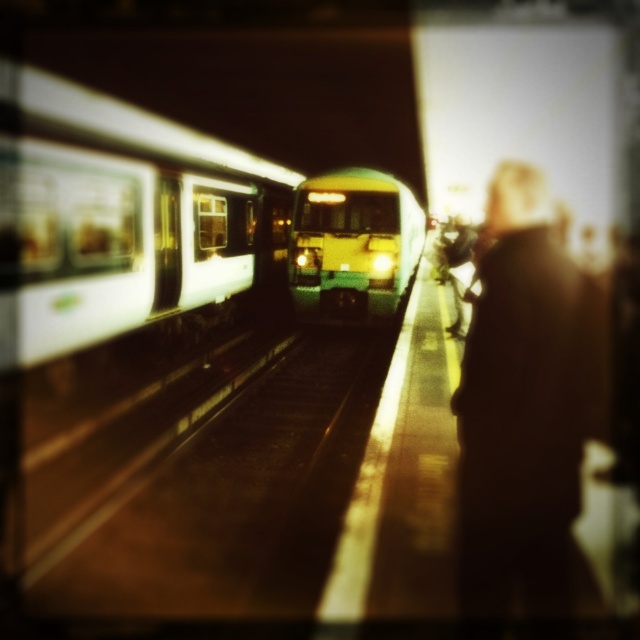
Is white glossy train at left bigger than green matte train at center?

Actually, white glossy train at left might be smaller than green matte train at center.

Between point (44, 227) and point (310, 211), which one is positioned in front?

Positioned in front is point (44, 227).

Where is `white glossy train at left`? The width and height of the screenshot is (640, 640). white glossy train at left is located at coordinates (113, 216).

Between point (532, 538) and point (317, 216), which one is positioned behind?

Point (317, 216)

Can you confirm if dark brown coat at right is positioned below green matte train at center?

Indeed, dark brown coat at right is positioned under green matte train at center.

Who is more distant from viewer, (579, 600) or (330, 179)?

Point (330, 179)

Where is `dark brown coat at right`? The width and height of the screenshot is (640, 640). dark brown coat at right is located at coordinates (x=525, y=412).

Based on the photo, who is positioned more to the left, white glossy train at left or dark brown coat at right?

white glossy train at left is more to the left.

Is point (144, 154) farther from viewer compared to point (532, 252)?

That is True.

Find the location of a particular element. The width and height of the screenshot is (640, 640). white glossy train at left is located at coordinates (113, 216).